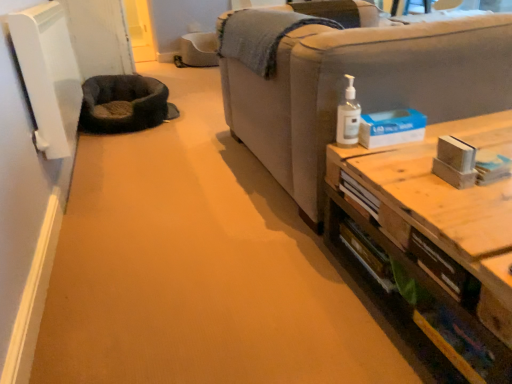
Question: From a real-world perspective, is wooden table at right above or below clear plastic pump bottle at upper right?

Choices:
 (A) above
 (B) below

Answer: (B)

Question: In terms of width, does wooden table at right look wider or thinner when compared to clear plastic pump bottle at upper right?

Choices:
 (A) thin
 (B) wide

Answer: (B)

Question: Which object is the farthest from the dark gray plush cat bed at left?

Choices:
 (A) wooden table at right
 (B) light gray fabric couch at right
 (C) clear plastic pump bottle at upper right

Answer: (A)

Question: Which object is the closest to the dark gray plush cat bed at left?

Choices:
 (A) clear plastic pump bottle at upper right
 (B) wooden table at right
 (C) light gray fabric couch at right

Answer: (C)